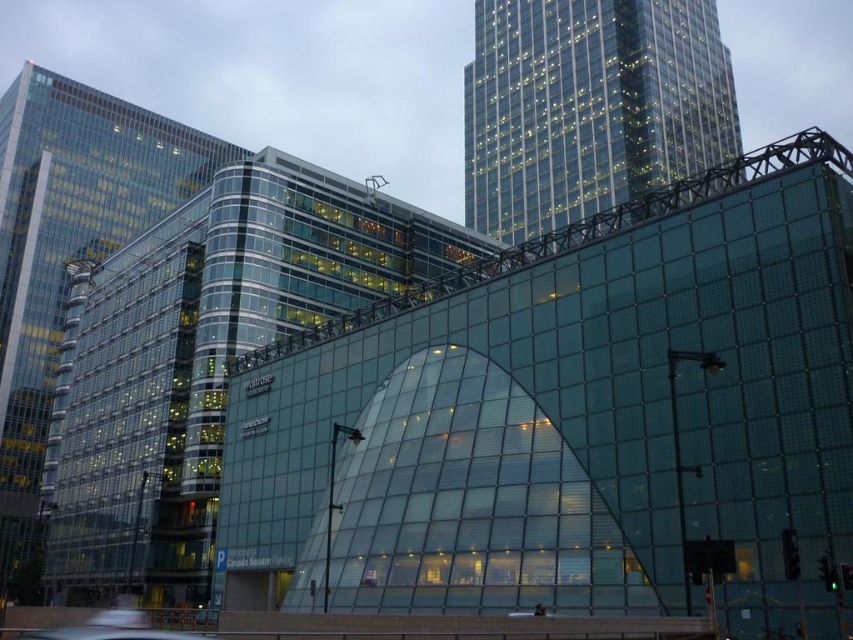
Question: Which point is closer to the camera?

Choices:
 (A) (576, 138)
 (B) (1, 260)

Answer: (A)

Question: Is transparent glass building at center bigger than transparent glass building at left?

Choices:
 (A) yes
 (B) no

Answer: (B)

Question: Which object appears closest to the camera in this image?

Choices:
 (A) transparent glass building at center
 (B) transparent glass skyscraper at upper center

Answer: (A)

Question: Is transparent glass building at center wider than transparent glass skyscraper at upper center?

Choices:
 (A) yes
 (B) no

Answer: (A)

Question: Which point is closer to the camera taking this photo?

Choices:
 (A) (125, 440)
 (B) (167, 168)
 (C) (584, 83)

Answer: (A)

Question: Observing the image, what is the correct spatial positioning of transparent glass building at center in reference to transparent glass building at left?

Choices:
 (A) below
 (B) above

Answer: (A)